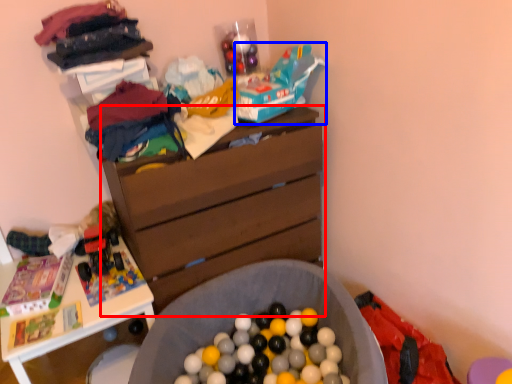
Question: Among these objects, which one is nearest to the camera, chest of drawers (highlighted by a red box) or toy car (highlighted by a blue box)?

Choices:
 (A) chest of drawers
 (B) toy car

Answer: (A)